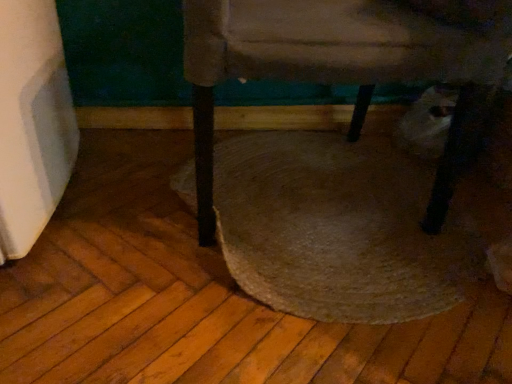
Question: Is point (425, 26) positioned closer to the camera than point (390, 160)?

Choices:
 (A) farther
 (B) closer

Answer: (B)

Question: From the image's perspective, is velvet beige chair at center located above or below rug at center?

Choices:
 (A) above
 (B) below

Answer: (A)

Question: Considering their positions, is velvet beige chair at center located in front of or behind rug at center?

Choices:
 (A) front
 (B) behind

Answer: (A)

Question: From a real-world perspective, relative to velvet beige chair at center, is rug at center vertically above or below?

Choices:
 (A) above
 (B) below

Answer: (B)

Question: From the image's perspective, is rug at center positioned above or below velvet beige chair at center?

Choices:
 (A) below
 (B) above

Answer: (A)

Question: Is rug at center taller or shorter than velvet beige chair at center?

Choices:
 (A) tall
 (B) short

Answer: (B)

Question: Is rug at center inside or outside of velvet beige chair at center?

Choices:
 (A) inside
 (B) outside

Answer: (A)